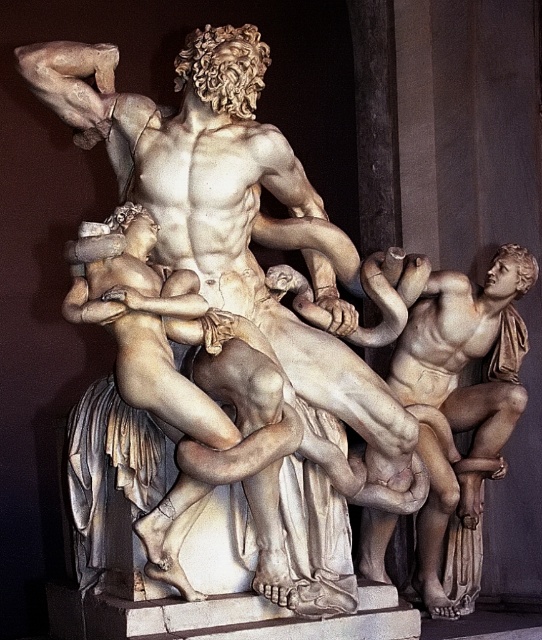
Who is taller, matte stone man at center or matte bronze statue at right?

matte bronze statue at right is taller.

What do you see at coordinates (170, 385) in the screenshot?
I see `matte stone man at center` at bounding box center [170, 385].

Is point (153, 349) closer to camera compared to point (435, 440)?

Yes, point (153, 349) is in front of point (435, 440).

At what (x,y) coordinates should I click in order to perform the action: click on matte stone man at center. Please return your answer as a coordinate pair (x, y). The image size is (542, 640). Looking at the image, I should click on (170, 385).

Can you confirm if white marble sculpture at center is positioned to the right of matte bronze statue at right?

No, white marble sculpture at center is not to the right of matte bronze statue at right.

Between point (253, 124) and point (425, 452), which one is positioned in front?

Point (253, 124) is more forward.

Where is `white marble sculpture at center`? This screenshot has height=640, width=542. white marble sculpture at center is located at coordinates (221, 337).

Which is more to the left, white marble sculpture at center or matte stone man at center?

Positioned to the left is matte stone man at center.

Who is taller, white marble sculpture at center or matte stone man at center?

white marble sculpture at center is taller.

Is point (63, 115) closer to viewer compared to point (150, 458)?

That is False.

This screenshot has height=640, width=542. In order to click on white marble sculpture at center in this screenshot , I will do click(221, 337).